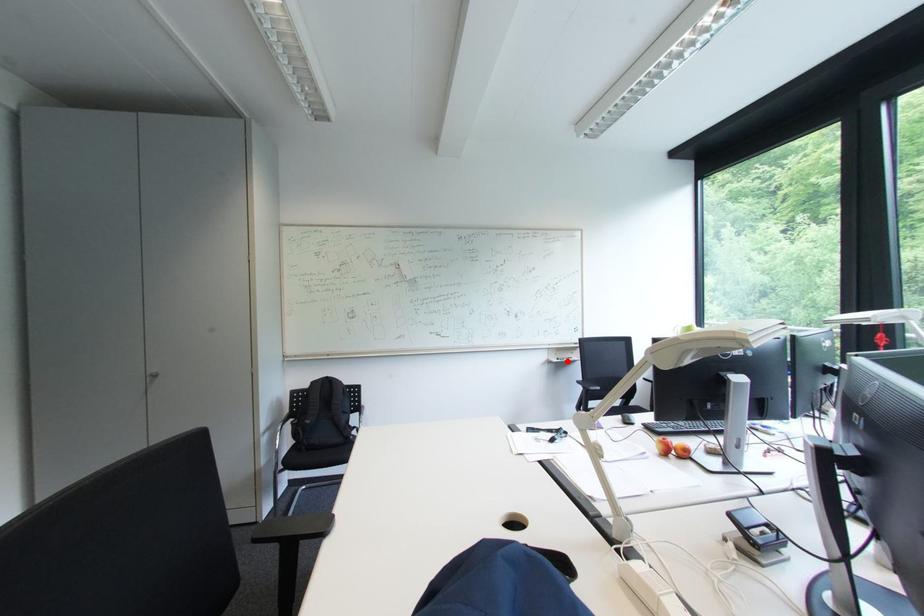
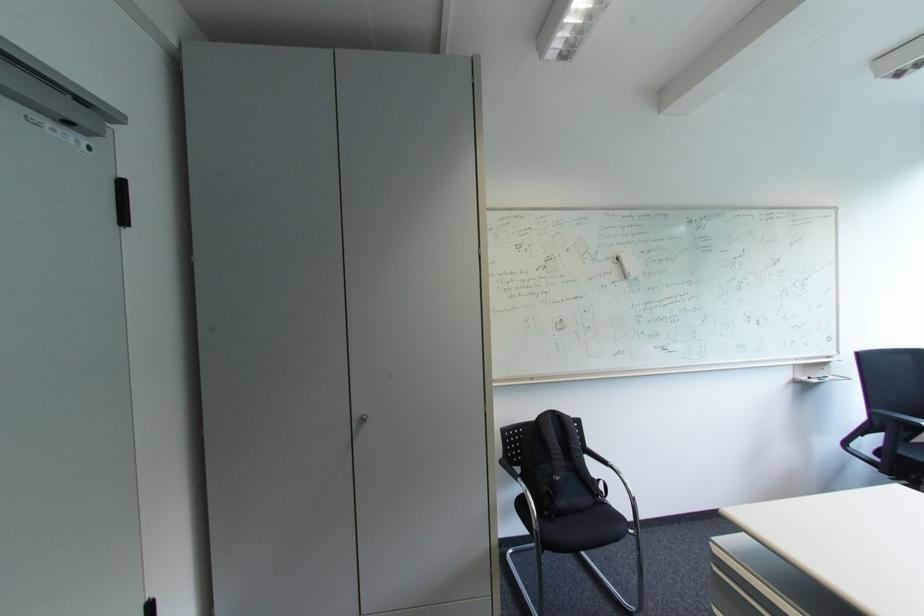
Question: I am providing you with two images of the same scene from different viewpoints. A red point is shown in image1. For the corresponding object point in image2, is it positioned nearer or farther from the camera?

Choices:
 (A) Nearer
 (B) Farther

Answer: (A)